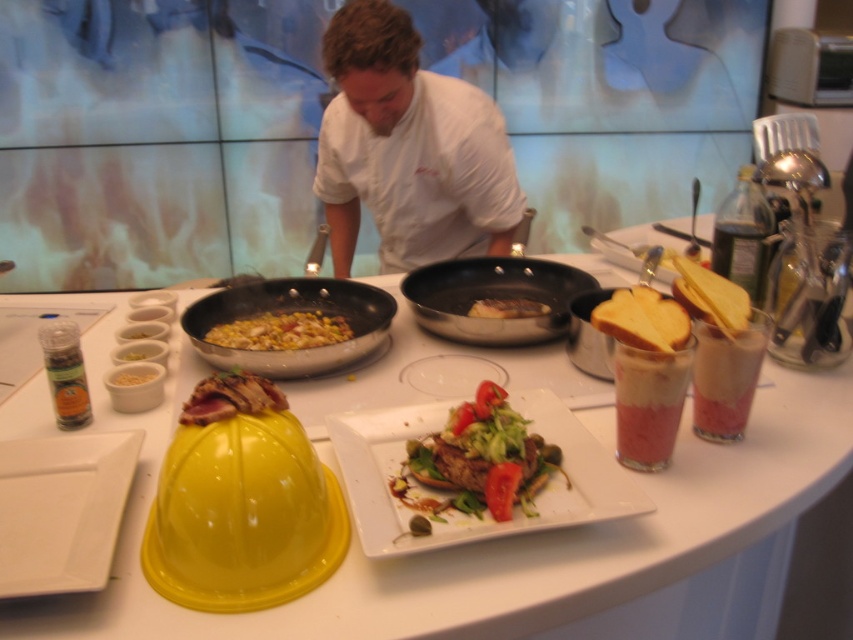
Question: Is white chef coat at center above white matte plate at lower left?

Choices:
 (A) no
 (B) yes

Answer: (B)

Question: Which point is closer to the camera?

Choices:
 (A) yellow glossy corn at center
 (B) shiny stainless steel wok at center
 (C) white creamy mashed potatoes at center

Answer: (B)

Question: Which of the following is the farthest from the observer?

Choices:
 (A) white chef coat at center
 (B) matte brown steak at center
 (C) white creamy mashed potatoes at center
 (D) white glossy plate at center

Answer: (A)

Question: Which of the following is the closest to the observer?

Choices:
 (A) white glossy plate at center
 (B) yellow glossy corn at center
 (C) smooth yellow bowl at center

Answer: (A)

Question: Can you confirm if white chef coat at center is wider than black non-stick pan at center?

Choices:
 (A) no
 (B) yes

Answer: (B)

Question: Is white matte plate at lower left further to camera compared to yellow glossy corn at center?

Choices:
 (A) yes
 (B) no

Answer: (B)